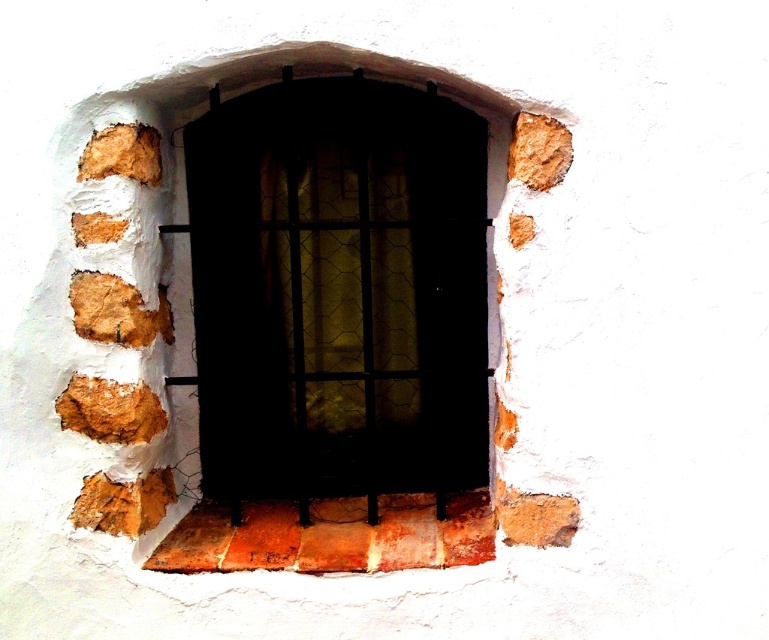
You are standing in front of a wall with a window. There is a point at coordinates point (338, 291). Based on the scene description, can you determine if this point is located on the matte black window at center or on the surrounding white plastered wall?

The point (338, 291) is on the matte black window at center according to the description.

You are an interior designer working on a project and need to place a decorative item between the matte black window at center and the rusty brick at center. The item you want to place is 8 inches wide. Can you fit it in the space between them?

The space between the matte black window at center and the rusty brick at center is 7.56 inches, which is narrower than the 8 inches wide decorative item. Therefore, the item cannot fit in the space between them.

You are standing in front of the window with the hexagonal lattice design. There are two points marked on the wall around the window. One is at coordinate point (330, 285) and the other is at point (475, 545). If you want to touch the point closer to you, which coordinate should you aim for?

You should aim for point (330, 285) because it is closer to you than point (475, 545).